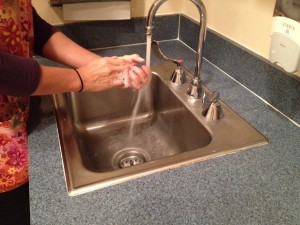
Find the location of a particular element. The width and height of the screenshot is (300, 225). wall is located at coordinates (250, 22).